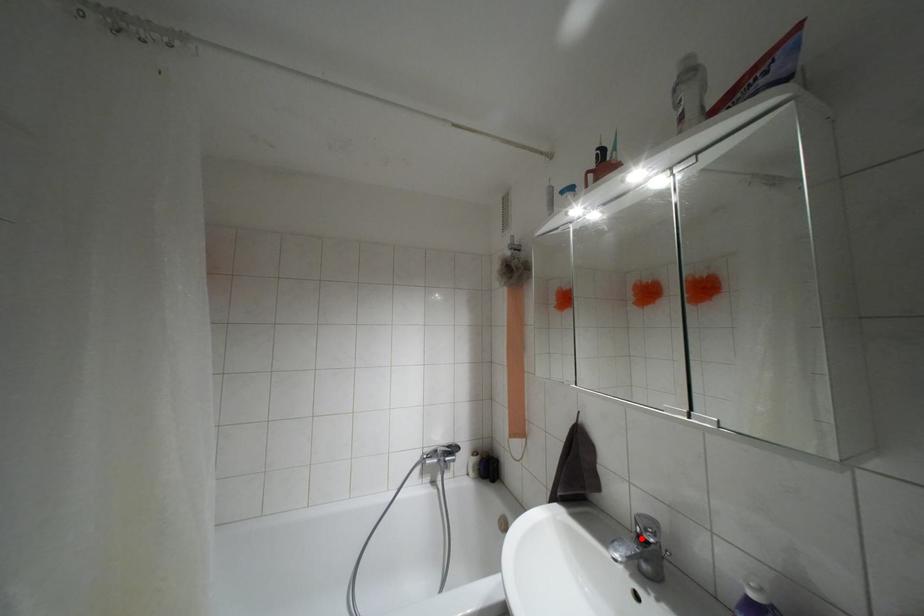
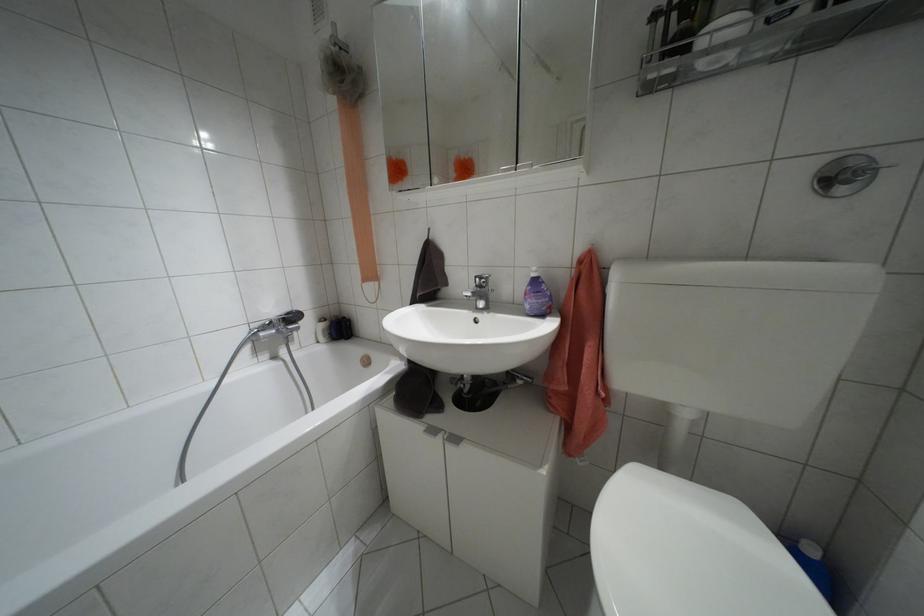
The point at the highlighted location is marked in the first image. Where is the corresponding point in the second image?

(479, 286)